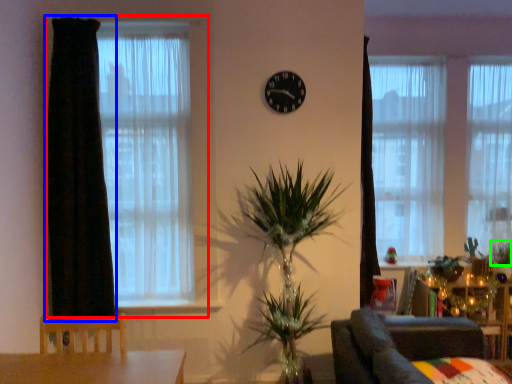
Question: Considering the real-world distances, which object is farthest from window (highlighted by a red box)? curtain (highlighted by a blue box) or plant (highlighted by a green box)?

Choices:
 (A) curtain
 (B) plant

Answer: (B)